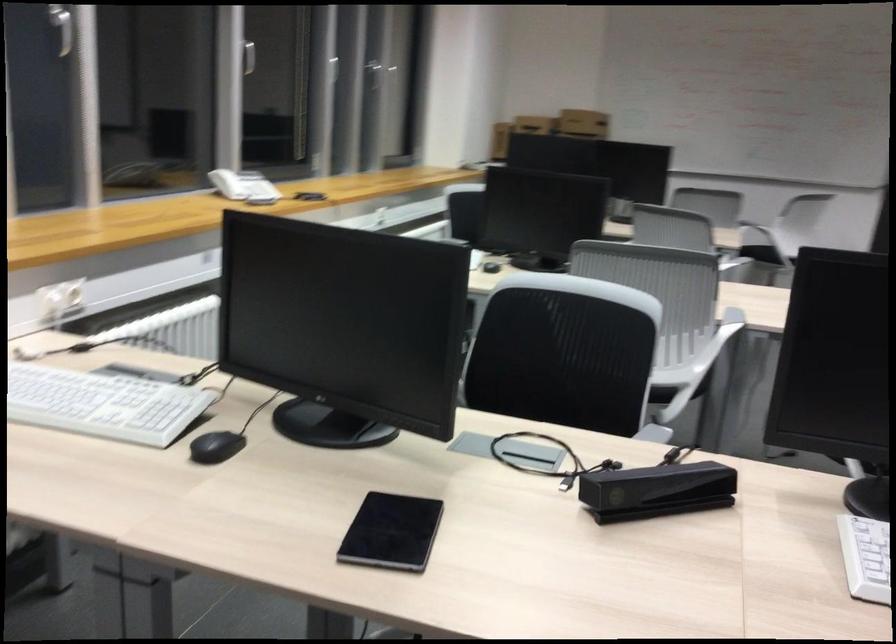
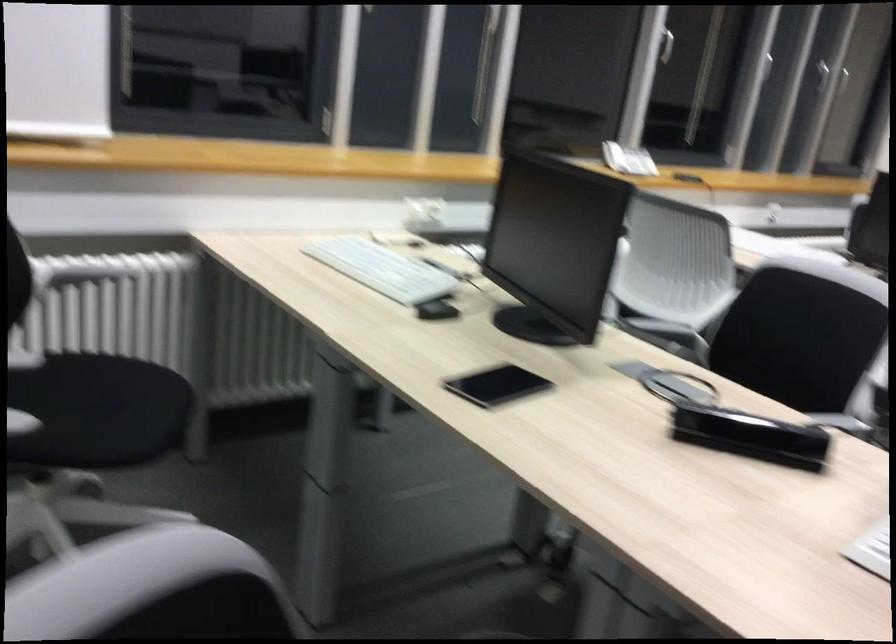
Where in the second image is the point corresponding to (x=236, y=194) from the first image?

(614, 156)